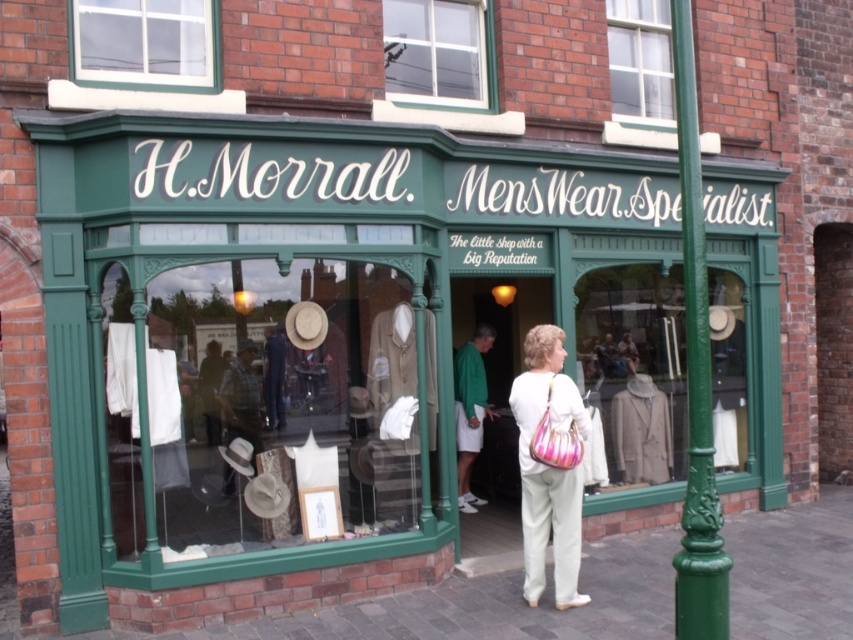
You are a customer standing in front of the H. Morrall Menswear Specialist store. You notice the green painted metal pole at right and the clear glass window at upper center. Which object is located to the right of the other?

The green painted metal pole at right is positioned on the right side of clear glass window at upper center.

You are a customer standing outside the H. Morrall Menswear Specialist store. You notice both the matte glass window at center and the white fabric handbag at center. Which object is taller?

The matte glass window at center is taller than the white fabric handbag at center.